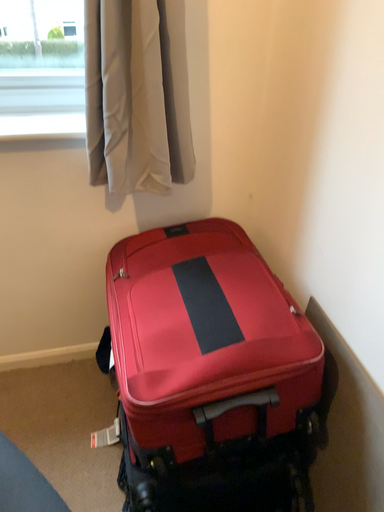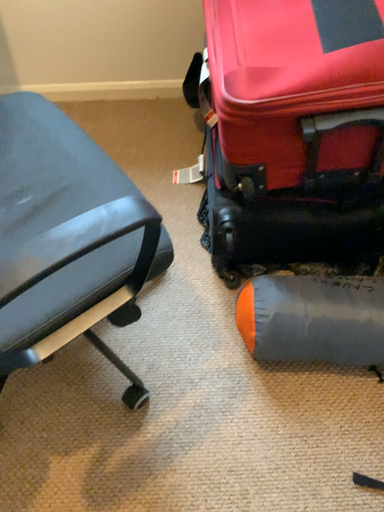
Question: How did the camera likely rotate when shooting the video?

Choices:
 (A) rotated downward
 (B) rotated upward

Answer: (A)